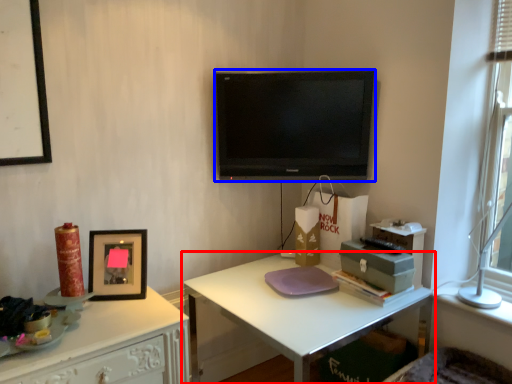
Question: Which of the following is the closest to the observer, desk (highlighted by a red box) or television (highlighted by a blue box)?

Choices:
 (A) desk
 (B) television

Answer: (A)